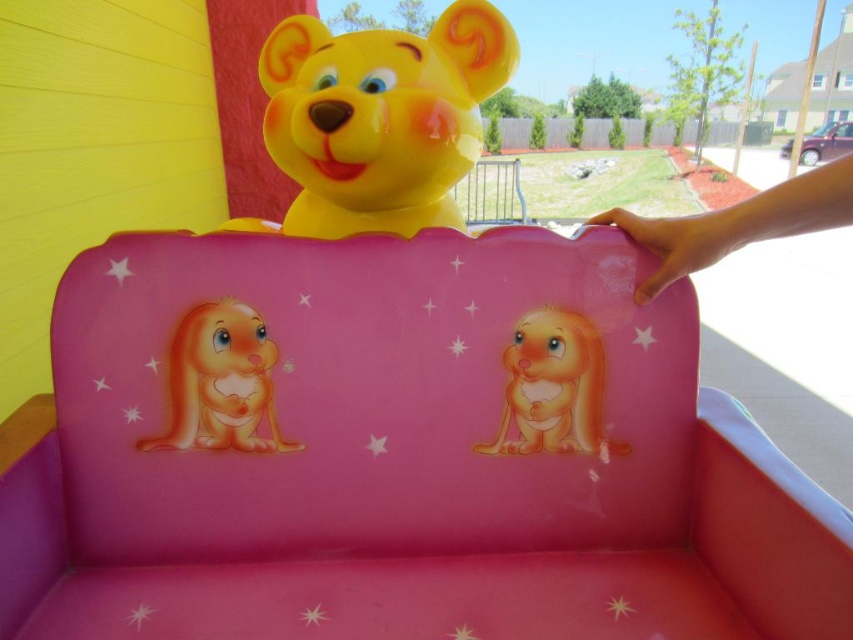
Who is positioned more to the left, pink plastic chair at center or matte yellow plastic teddy bear at upper center?

matte yellow plastic teddy bear at upper center

Is pink plastic chair at center thinner than matte yellow plastic teddy bear at upper center?

In fact, pink plastic chair at center might be wider than matte yellow plastic teddy bear at upper center.

What do you see at coordinates (399, 452) in the screenshot? This screenshot has width=853, height=640. I see `pink plastic chair at center` at bounding box center [399, 452].

At what (x,y) coordinates should I click in order to perform the action: click on pink plastic chair at center. Please return your answer as a coordinate pair (x, y). Image resolution: width=853 pixels, height=640 pixels. Looking at the image, I should click on (399, 452).

Who is shorter, glossy plastic bunny at left or matte orange plush rabbit at center?

Standing shorter between the two is matte orange plush rabbit at center.

Can you confirm if glossy plastic bunny at left is wider than matte orange plush rabbit at center?

Indeed, glossy plastic bunny at left has a greater width compared to matte orange plush rabbit at center.

Does point (212, 424) come closer to viewer compared to point (602, 376)?

Yes, point (212, 424) is closer to viewer.

Image resolution: width=853 pixels, height=640 pixels. I want to click on glossy plastic bunny at left, so click(221, 381).

Who is more forward, (318, 42) or (199, 378)?

Point (199, 378) is more forward.

Can you confirm if matte yellow plastic teddy bear at upper center is positioned above glossy plastic bunny at left?

Yes.

Locate an element on the screen. This screenshot has height=640, width=853. matte yellow plastic teddy bear at upper center is located at coordinates (378, 120).